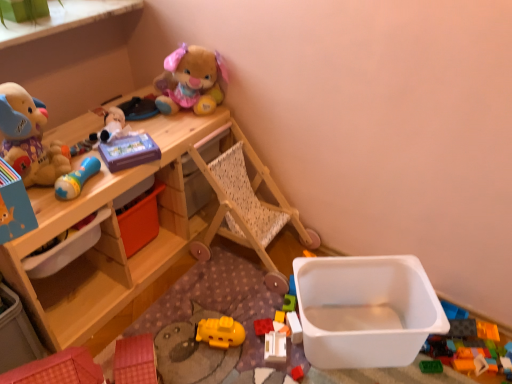
Find the location of a particular element. free space on the front side of yellow plastic toy at center, the 5th toy positioned from the bottom is located at coordinates (285, 364).